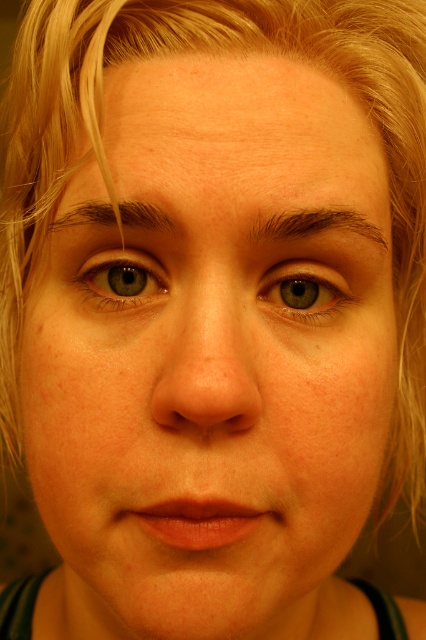
Question: Which of the following is the farthest from the observer?

Choices:
 (A) (261, 221)
 (B) (126, 208)
 (C) (302, 288)

Answer: (C)

Question: Which point is closer to the camera?

Choices:
 (A) green matte eye at upper left
 (B) green matte eye at center

Answer: (B)

Question: Can you confirm if green matte eye at upper left is positioned to the right of dark brown hair at upper center?

Choices:
 (A) yes
 (B) no

Answer: (A)

Question: Can you confirm if green matte eye at center is bigger than brown textured eyebrow at upper center?

Choices:
 (A) yes
 (B) no

Answer: (B)

Question: Does green matte eye at upper left have a smaller size compared to brown textured eyebrow at upper center?

Choices:
 (A) no
 (B) yes

Answer: (B)

Question: Which of these objects is positioned closest to the green matte eye at upper left?

Choices:
 (A) green matte eye at center
 (B) brown textured eyebrow at upper center
 (C) dark brown hair at upper center

Answer: (C)